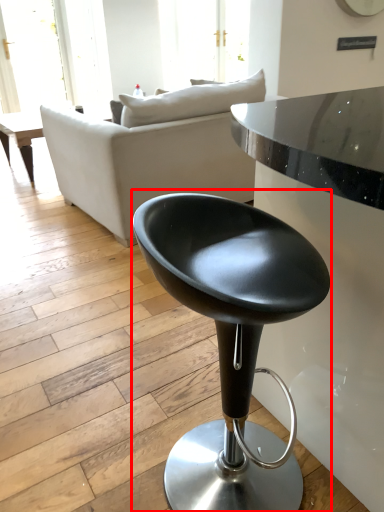
Question: From the image's perspective, what is the correct spatial relationship of chair (annotated by the red box) in relation to studio couch?

Choices:
 (A) above
 (B) below

Answer: (B)